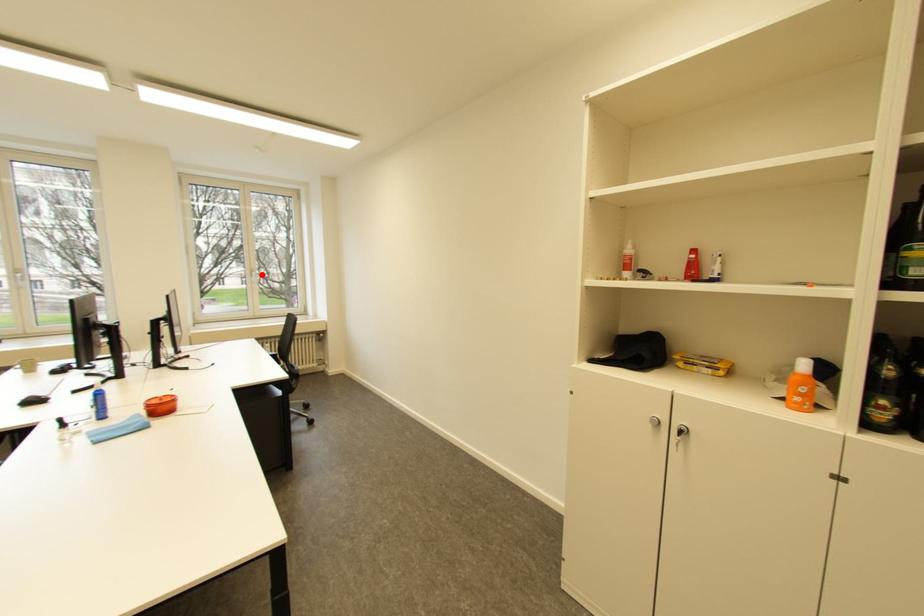
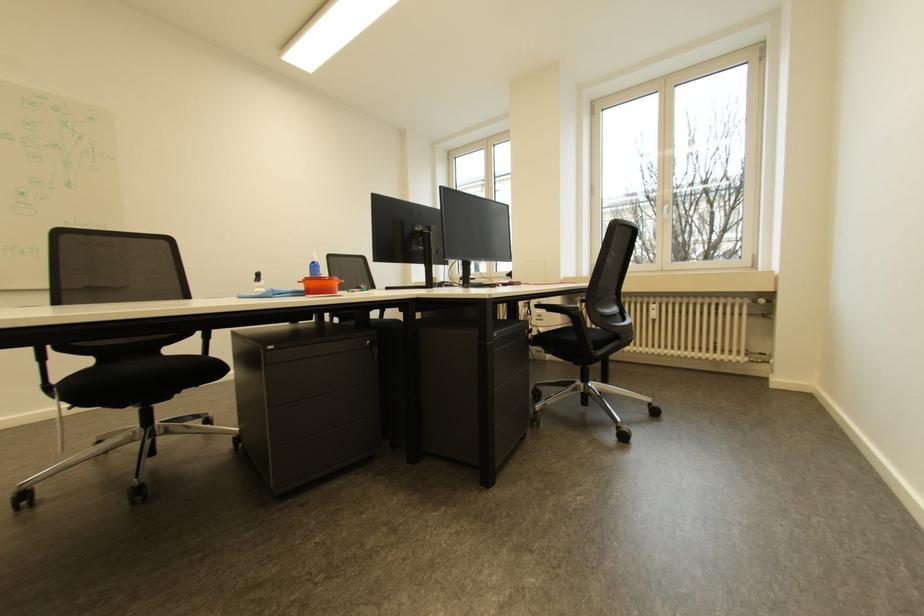
Locate, in the second image, the point that corresponds to the highlighted location in the first image.

(672, 209)